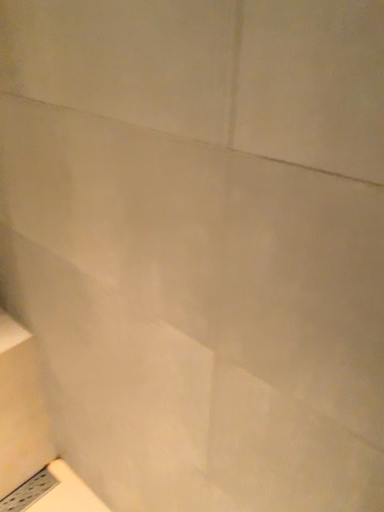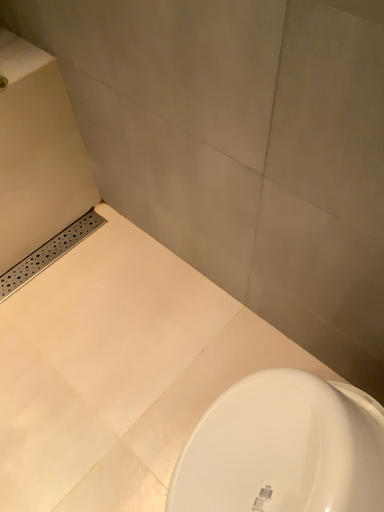
Question: Which way did the camera rotate in the video?

Choices:
 (A) rotated downward
 (B) rotated upward

Answer: (A)